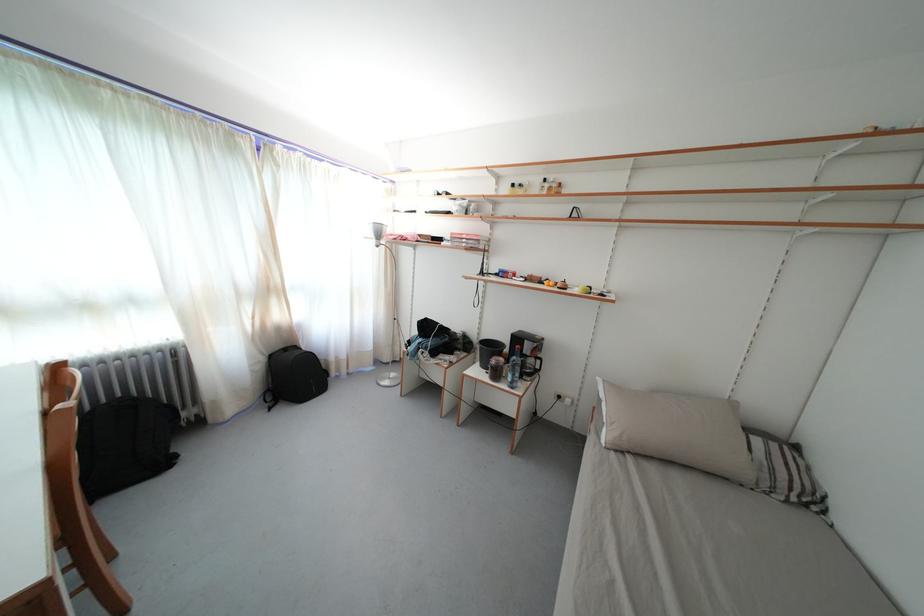
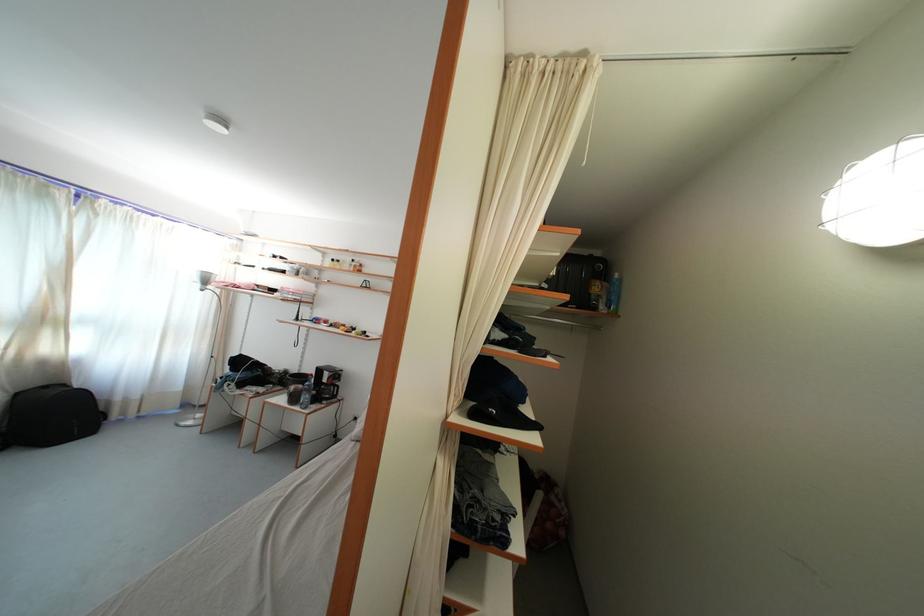
Where in the second image is the point corresponding to point 503,379 from the first image?

(300, 405)